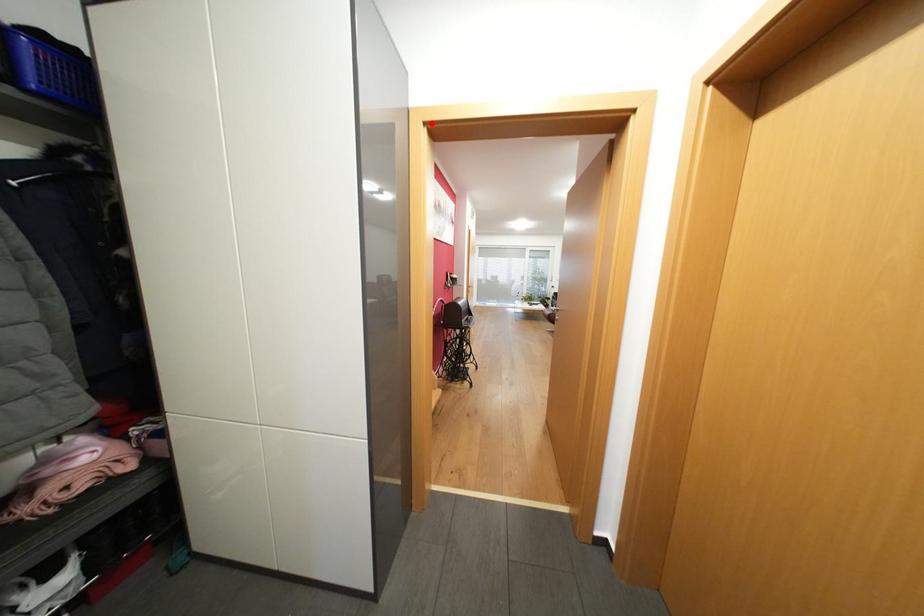
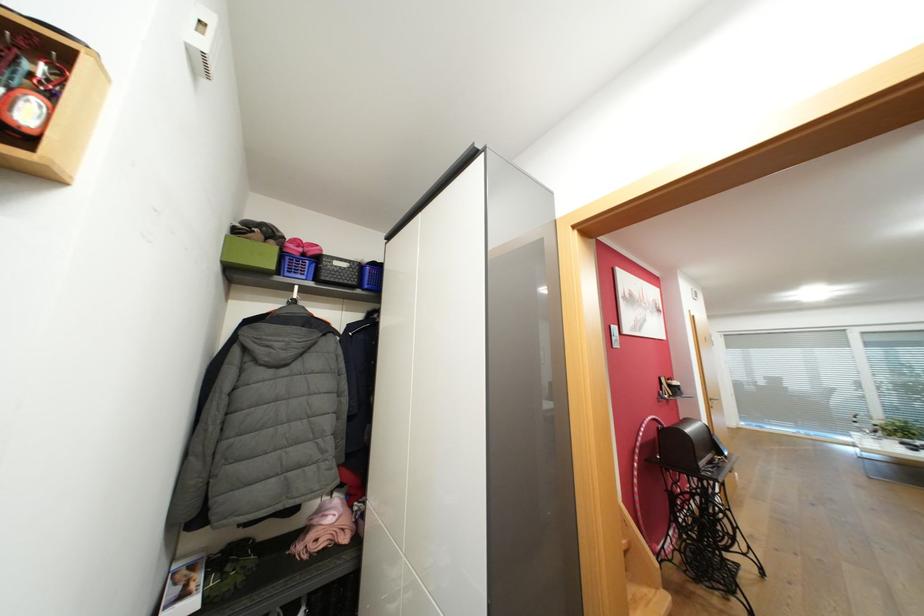
Find the pixel in the second image that matches the highlighted location in the first image.

(580, 227)